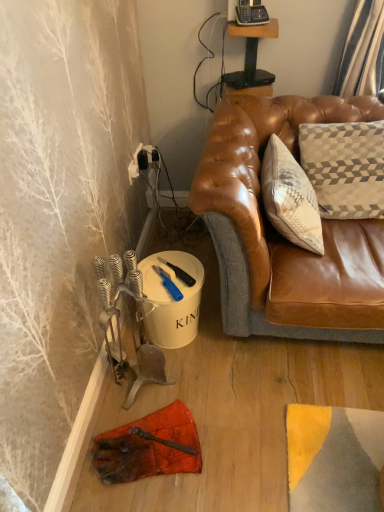
The height and width of the screenshot is (512, 384). Identify the location of wooden table at upper center. (251, 60).

Image resolution: width=384 pixels, height=512 pixels. What do you see at coordinates (168, 284) in the screenshot? I see `blue plastic utility knife at lower center, the 2th tool when ordered from top to bottom` at bounding box center [168, 284].

Where is `blue plastic knife at lower center, the first tool from the top`? The height and width of the screenshot is (512, 384). blue plastic knife at lower center, the first tool from the top is located at coordinates (180, 273).

Which is correct: blue plastic knife at lower center, arranged as the 2th tool when ordered from the bottom, is inside wooden table at upper center, or outside of it?

blue plastic knife at lower center, arranged as the 2th tool when ordered from the bottom, is not enclosed by wooden table at upper center.

Is there a large distance between blue plastic knife at lower center, the first tool from the top, and wooden table at upper center?

They are positioned close to each other.

From a real-world perspective, between blue plastic knife at lower center, the first tool from the top, and wooden table at upper center, who is vertically lower?

blue plastic knife at lower center, the first tool from the top, from a real-world perspective.

Find the location of a particular element. table located above the blue plastic knife at lower center, the first tool from the top (from the image's perspective) is located at coordinates (251, 60).

Can you confirm if blue plastic knife at lower center, arranged as the 2th tool when ordered from the bottom, is thinner than blue plastic utility knife at lower center, the 2th tool when ordered from top to bottom?

In fact, blue plastic knife at lower center, arranged as the 2th tool when ordered from the bottom, might be wider than blue plastic utility knife at lower center, the 2th tool when ordered from top to bottom.

Considering the points (162, 262) and (171, 296), which point is in front, point (162, 262) or point (171, 296)?

Point (171, 296)

Is blue plastic utility knife at lower center, the 2th tool when ordered from top to bottom, at the back of blue plastic knife at lower center, the first tool from the top?

No.

Between blue plastic knife at lower center, arranged as the 2th tool when ordered from the bottom, and blue plastic utility knife at lower center, the first tool when ordered from bottom to top, which one has smaller size?

blue plastic knife at lower center, arranged as the 2th tool when ordered from the bottom.

Does wooden table at upper center have a lesser height compared to blue plastic utility knife at lower center, the first tool when ordered from bottom to top?

No.

Can you tell me how much wooden table at upper center and blue plastic utility knife at lower center, the 2th tool when ordered from top to bottom, differ in facing direction?

39.8 degrees separate the facing orientations of wooden table at upper center and blue plastic utility knife at lower center, the 2th tool when ordered from top to bottom.

Which object is thinner, wooden table at upper center or blue plastic utility knife at lower center, the 2th tool when ordered from top to bottom?

Thinner between the two is wooden table at upper center.

In the scene shown: From a real-world perspective, is wooden table at upper center beneath blue plastic utility knife at lower center, the first tool when ordered from bottom to top?

No.

Looking at this image, is wooden table at upper center in front of or behind blue plastic knife at lower center, arranged as the 2th tool when ordered from the bottom, in the image?

In the image, wooden table at upper center appears behind blue plastic knife at lower center, arranged as the 2th tool when ordered from the bottom.

In terms of size, does wooden table at upper center appear bigger or smaller than blue plastic knife at lower center, the first tool from the top?

Clearly, wooden table at upper center is larger in size than blue plastic knife at lower center, the first tool from the top.

Is wooden table at upper center oriented away from blue plastic knife at lower center, arranged as the 2th tool when ordered from the bottom?

No.

Does wooden table at upper center have a greater width compared to blue plastic knife at lower center, arranged as the 2th tool when ordered from the bottom?

In fact, wooden table at upper center might be narrower than blue plastic knife at lower center, arranged as the 2th tool when ordered from the bottom.

Does blue plastic utility knife at lower center, the first tool when ordered from bottom to top, appear on the right side of blue plastic knife at lower center, arranged as the 2th tool when ordered from the bottom?

In fact, blue plastic utility knife at lower center, the first tool when ordered from bottom to top, is to the left of blue plastic knife at lower center, arranged as the 2th tool when ordered from the bottom.

Is blue plastic utility knife at lower center, the 2th tool when ordered from top to bottom, aimed at blue plastic knife at lower center, the first tool from the top?

No.

Is blue plastic knife at lower center, the first tool from the top, a part of blue plastic utility knife at lower center, the first tool when ordered from bottom to top?

That's incorrect, blue plastic knife at lower center, the first tool from the top, is not inside blue plastic utility knife at lower center, the first tool when ordered from bottom to top.

From their relative heights in the image, would you say blue plastic utility knife at lower center, the 2th tool when ordered from top to bottom, is taller or shorter than wooden table at upper center?

Clearly, blue plastic utility knife at lower center, the 2th tool when ordered from top to bottom, is shorter compared to wooden table at upper center.

Is blue plastic utility knife at lower center, the 2th tool when ordered from top to bottom, turned away from wooden table at upper center?

No, blue plastic utility knife at lower center, the 2th tool when ordered from top to bottom, is not facing the opposite direction of wooden table at upper center.

From the image's perspective, which tool is the 2nd one below the wooden table at upper center? Please provide its 2D coordinates.

[(168, 284)]

Would you say blue plastic utility knife at lower center, the 2th tool when ordered from top to bottom, is to the left or to the right of wooden table at upper center in the picture?

From the image, it's evident that blue plastic utility knife at lower center, the 2th tool when ordered from top to bottom, is to the left of wooden table at upper center.

Where is `table on the right of blue plastic knife at lower center, the first tool from the top`? table on the right of blue plastic knife at lower center, the first tool from the top is located at coordinates (x=251, y=60).

Where is `tool above the blue plastic utility knife at lower center, the first tool when ordered from bottom to top (from a real-world perspective)`? tool above the blue plastic utility knife at lower center, the first tool when ordered from bottom to top (from a real-world perspective) is located at coordinates (180, 273).

Based on the photo, based on their spatial positions, is wooden table at upper center or blue plastic utility knife at lower center, the 2th tool when ordered from top to bottom, further from blue plastic knife at lower center, the first tool from the top?

wooden table at upper center is further to blue plastic knife at lower center, the first tool from the top.

Considering their positions, is blue plastic utility knife at lower center, the first tool when ordered from bottom to top, positioned further to blue plastic knife at lower center, the first tool from the top, than wooden table at upper center?

The object further to blue plastic knife at lower center, the first tool from the top, is wooden table at upper center.

Based on the photo, estimate the real-world distances between objects in this image. Which object is closer to wooden table at upper center, blue plastic utility knife at lower center, the 2th tool when ordered from top to bottom, or blue plastic knife at lower center, arranged as the 2th tool when ordered from the bottom?

Among the two, blue plastic knife at lower center, arranged as the 2th tool when ordered from the bottom, is located nearer to wooden table at upper center.

In the scene shown: From the image, which object appears to be nearer to blue plastic utility knife at lower center, the first tool when ordered from bottom to top, blue plastic knife at lower center, arranged as the 2th tool when ordered from the bottom, or wooden table at upper center?

blue plastic knife at lower center, arranged as the 2th tool when ordered from the bottom.

Looking at the image, which one is located closer to blue plastic utility knife at lower center, the 2th tool when ordered from top to bottom, wooden table at upper center or blue plastic knife at lower center, the first tool from the top?

Based on the image, blue plastic knife at lower center, the first tool from the top, appears to be nearer to blue plastic utility knife at lower center, the 2th tool when ordered from top to bottom.

When comparing their distances from wooden table at upper center, does blue plastic knife at lower center, the first tool from the top, or blue plastic utility knife at lower center, the first tool when ordered from bottom to top, seem closer?

Among the two, blue plastic knife at lower center, the first tool from the top, is located nearer to wooden table at upper center.

The width and height of the screenshot is (384, 512). In order to click on tool between wooden table at upper center and blue plastic utility knife at lower center, the first tool when ordered from bottom to top, vertically in this screenshot , I will do `click(180, 273)`.